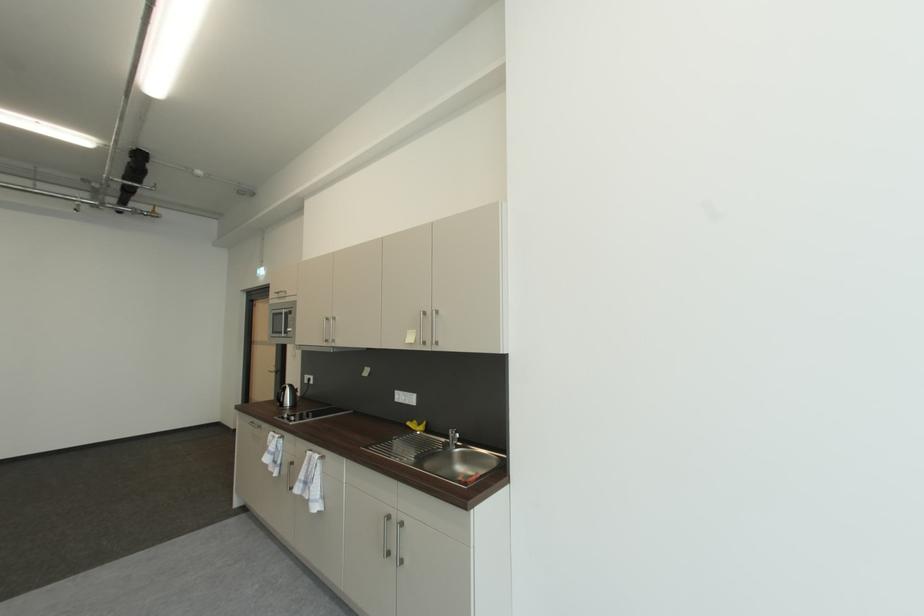
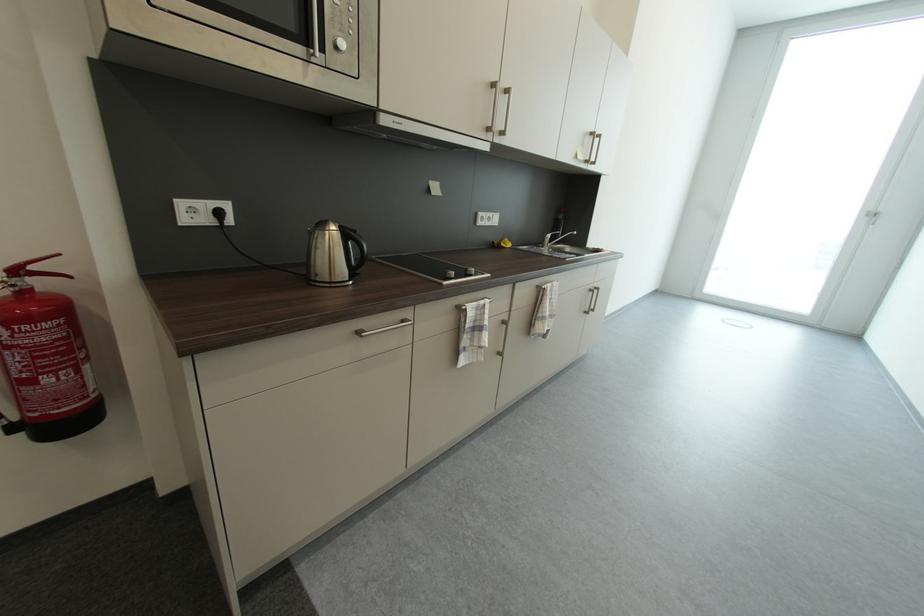
In the second image, find the point that corresponds to pixel 419 423 in the first image.

(501, 244)